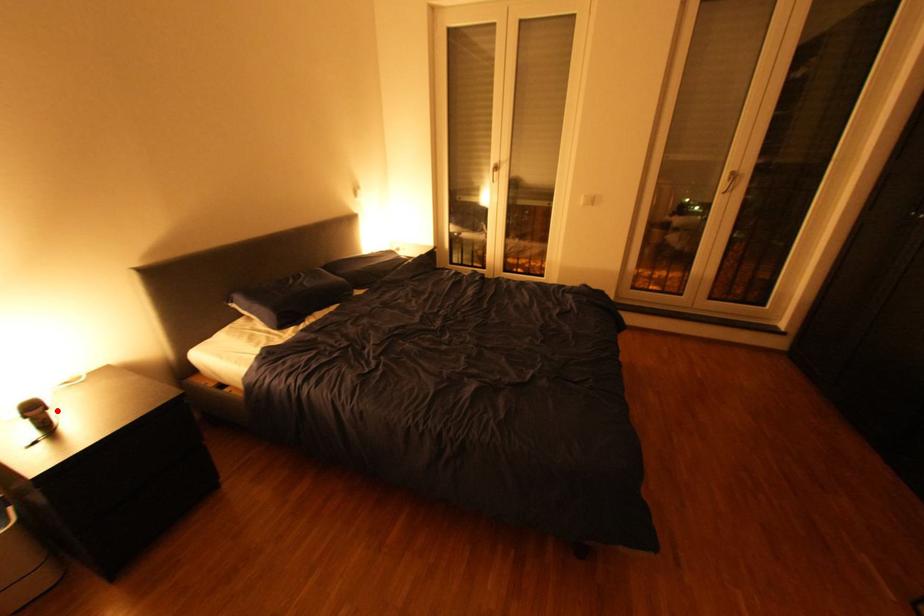
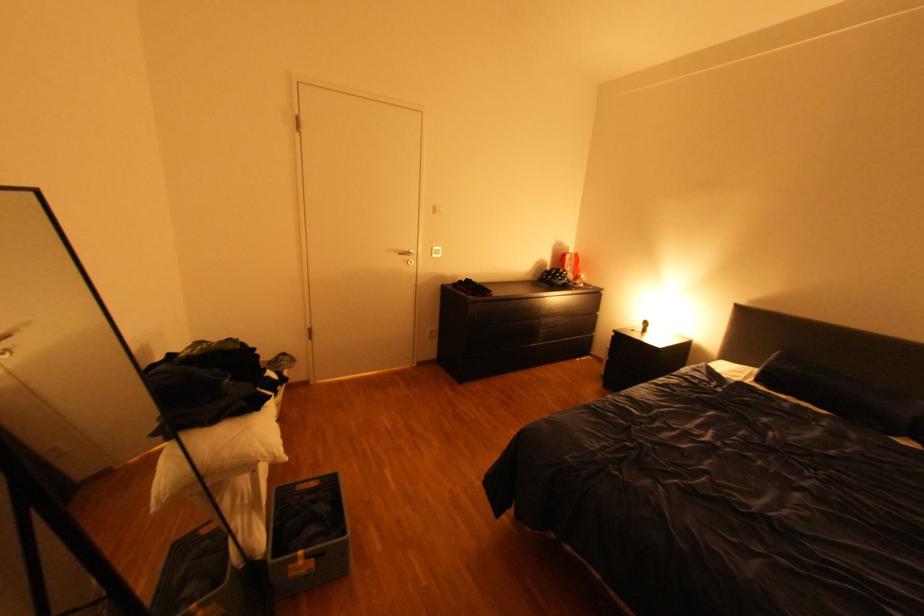
The point at the highlighted location is marked in the first image. Where is the corresponding point in the second image?

(659, 328)